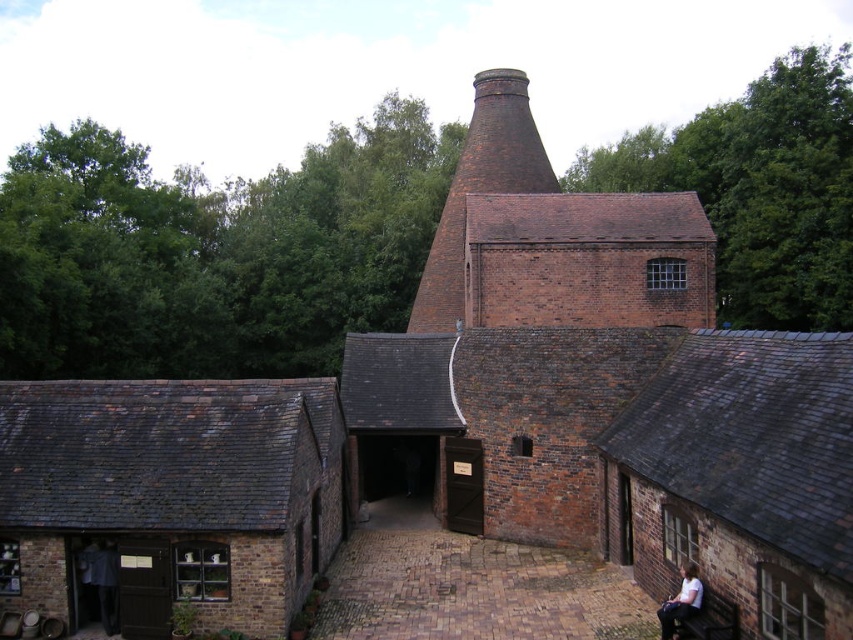
Question: Which object is closer to the camera taking this photo?

Choices:
 (A) brown brick chimney at center
 (B) white cotton shirt at lower right

Answer: (B)

Question: Can you confirm if brown brick chimney at center is thinner than white cotton shirt at lower right?

Choices:
 (A) yes
 (B) no

Answer: (B)

Question: Is brown brick chimney at center to the left of white cotton shirt at lower right from the viewer's perspective?

Choices:
 (A) no
 (B) yes

Answer: (B)

Question: Does brown brick chimney at center appear on the right side of white cotton shirt at lower right?

Choices:
 (A) no
 (B) yes

Answer: (A)